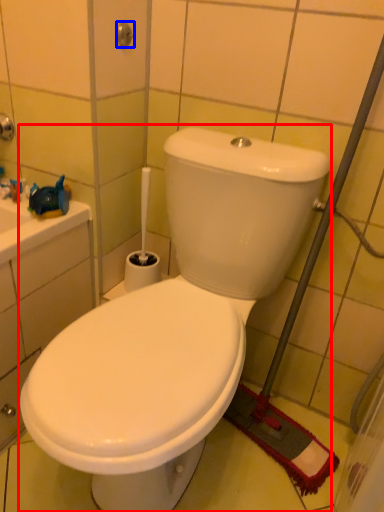
Question: Which object appears farthest to the camera in this image, toilet (highlighted by a red box) or shower (highlighted by a blue box)?

Choices:
 (A) toilet
 (B) shower

Answer: (B)